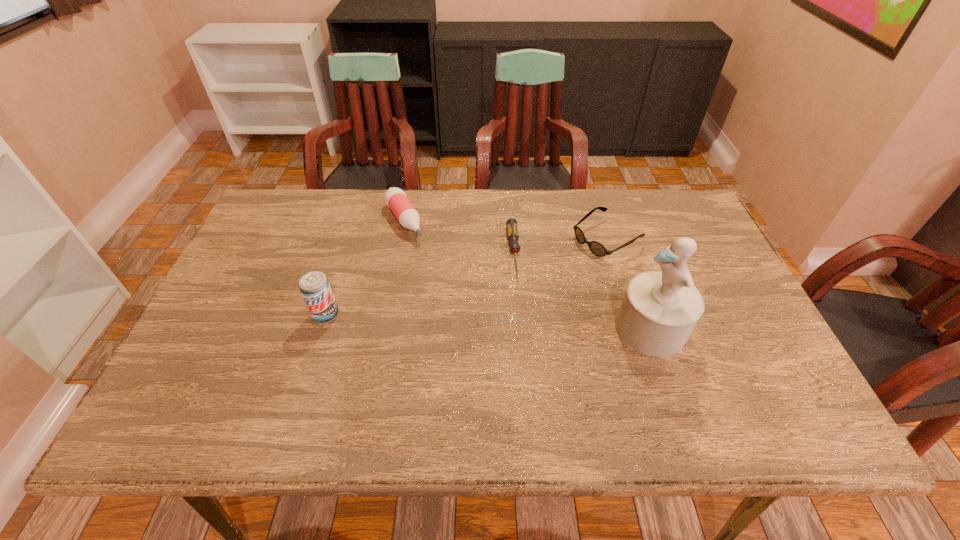
Identify the location of object that ranks as the second closest to the second shortest object. (512, 228).

The image size is (960, 540). I want to click on the fourth closest object to the third shortest object, so click(660, 308).

Where is `vacant space that satisfies the following two spatial constraints: 1. on the back side of the beer can; 2. on the right side of the screwdriver`? This screenshot has height=540, width=960. vacant space that satisfies the following two spatial constraints: 1. on the back side of the beer can; 2. on the right side of the screwdriver is located at coordinates (345, 253).

The width and height of the screenshot is (960, 540). What are the coordinates of `vacant position in the image that satisfies the following two spatial constraints: 1. on the front side of the tallest object; 2. at the beak of the sunglasses` in the screenshot? It's located at (635, 329).